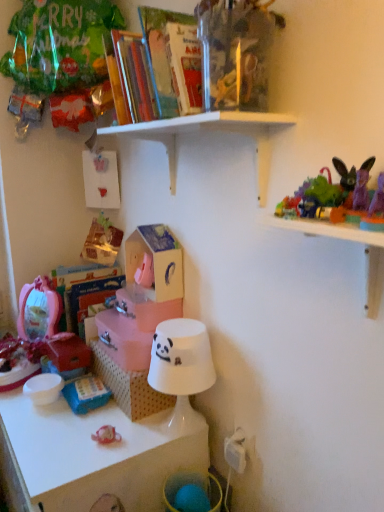
Where is `vacant space that is to the left of white matte lampshade at center`? This screenshot has width=384, height=512. vacant space that is to the left of white matte lampshade at center is located at coordinates (117, 434).